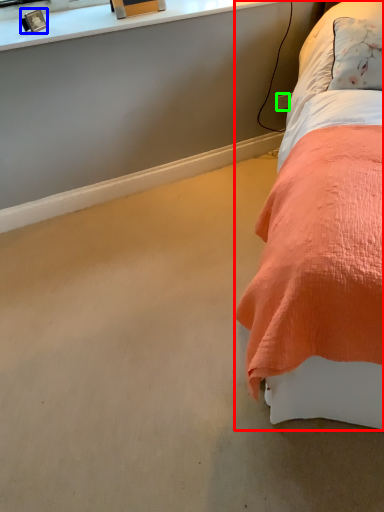
Question: Which object is positioned farthest from bed (highlighted by a red box)? Select from picture frame (highlighted by a blue box) and power outlet (highlighted by a green box).

Choices:
 (A) picture frame
 (B) power outlet

Answer: (A)